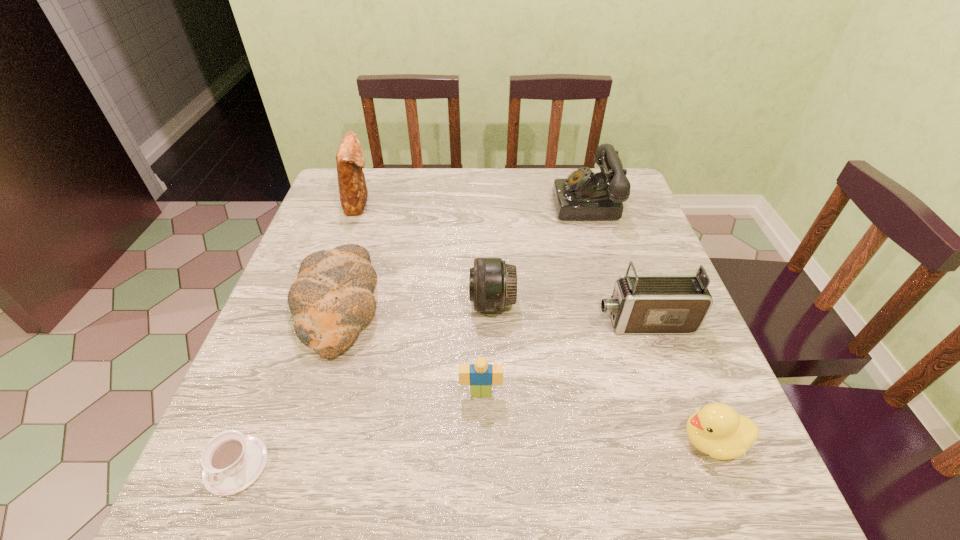
Identify the location of vacant space situated 0.310m on the beak of the duckling. (498, 441).

Locate an element on the screen. vacant space located on the beak of the duckling is located at coordinates (445, 441).

This screenshot has height=540, width=960. In order to click on vacant space located 0.090m on the beak of the duckling in this screenshot , I will do `click(626, 441)`.

Locate an element on the screen. The image size is (960, 540). clutch bag that is at the far edge is located at coordinates (350, 160).

The height and width of the screenshot is (540, 960). In order to click on telephone at the far edge in this screenshot , I will do `click(583, 195)`.

This screenshot has height=540, width=960. I want to click on duckling that is positioned at the near edge, so pos(716,429).

Identify the location of teacup present at the near edge. (231, 461).

Image resolution: width=960 pixels, height=540 pixels. I want to click on clutch bag at the left edge, so click(350, 160).

You are a GUI agent. You are given a task and a screenshot of the screen. Output one action in this format:
    pyautogui.click(x=<x>, y=<y>)
    Task: Click on the bread located in the left edge section of the desktop
    
    Given the screenshot: What is the action you would take?
    pyautogui.click(x=332, y=298)

Where is `teacup that is at the left edge`? The image size is (960, 540). teacup that is at the left edge is located at coordinates pos(231,461).